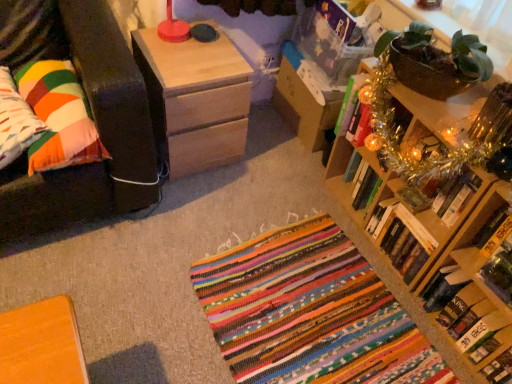
The width and height of the screenshot is (512, 384). Find the location of `vacant region to the left of hardcover book at lower right, marked as the 1th book in a bottom-to-top arrangement`. vacant region to the left of hardcover book at lower right, marked as the 1th book in a bottom-to-top arrangement is located at coordinates (400, 321).